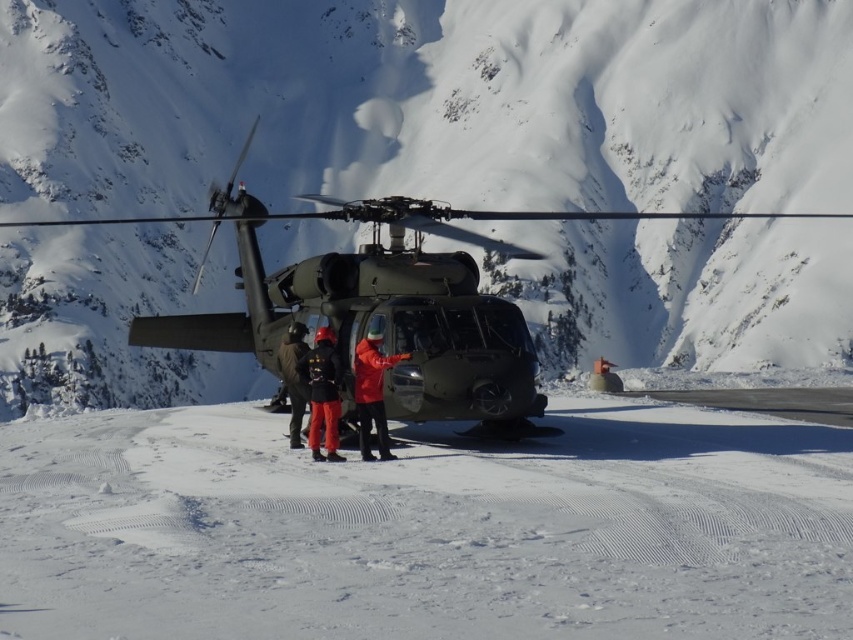
Question: Which point appears farthest from the camera in this image?

Choices:
 (A) (332, 433)
 (B) (363, 356)
 (C) (152, 600)

Answer: (B)

Question: Can you confirm if red matte jacket at center is positioned to the left of red jacket at center?

Choices:
 (A) no
 (B) yes

Answer: (A)

Question: Which point is farther to the camera?

Choices:
 (A) (149, 472)
 (B) (404, 353)
 (C) (285, 275)
 (D) (291, 410)

Answer: (D)

Question: Can you confirm if white powdery snow at center is bigger than matte black helicopter at center?

Choices:
 (A) no
 (B) yes

Answer: (A)

Question: Does matte black jacket at center appear on the left side of red matte jacket at center?

Choices:
 (A) yes
 (B) no

Answer: (A)

Question: Estimate the real-world distances between objects in this image. Which object is farther from the white powdery snow at center?

Choices:
 (A) red matte jacket at center
 (B) red jacket at center
 (C) matte black helicopter at center
 (D) matte black jacket at center

Answer: (C)